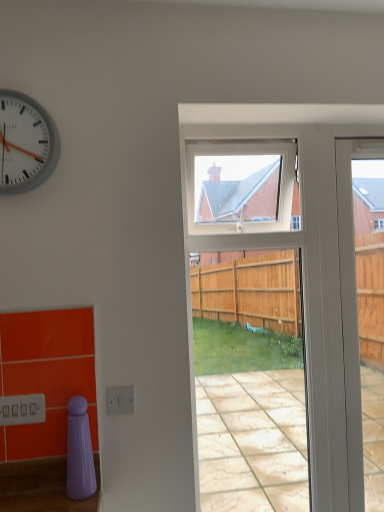
Question: Is white plastic clock at upper left surrounded by clear glass screen door at center?

Choices:
 (A) no
 (B) yes

Answer: (A)

Question: Is clear glass screen door at center thinner than white plastic clock at upper left?

Choices:
 (A) no
 (B) yes

Answer: (A)

Question: From a real-world perspective, is clear glass screen door at center under white plastic clock at upper left?

Choices:
 (A) yes
 (B) no

Answer: (A)

Question: Is clear glass screen door at center further to the viewer compared to white plastic clock at upper left?

Choices:
 (A) yes
 (B) no

Answer: (A)

Question: From the image's perspective, is clear glass screen door at center below white plastic clock at upper left?

Choices:
 (A) yes
 (B) no

Answer: (A)

Question: Does point (344, 346) appear closer or farther from the camera than point (355, 154)?

Choices:
 (A) farther
 (B) closer

Answer: (B)

Question: From the image's perspective, relative to white glossy door at right, is clear glass screen door at center above or below?

Choices:
 (A) below
 (B) above

Answer: (A)

Question: In terms of width, does clear glass screen door at center look wider or thinner when compared to white glossy door at right?

Choices:
 (A) wide
 (B) thin

Answer: (A)

Question: Based on their positions, is clear glass screen door at center located to the left or right of white glossy door at right?

Choices:
 (A) right
 (B) left

Answer: (B)

Question: From a real-world perspective, is white glossy door at right physically located above or below white plastic clock at upper left?

Choices:
 (A) above
 (B) below

Answer: (B)

Question: Considering the relative positions of white glossy door at right and white plastic clock at upper left in the image provided, is white glossy door at right to the left or to the right of white plastic clock at upper left?

Choices:
 (A) left
 (B) right

Answer: (B)

Question: Relative to white plastic clock at upper left, is white glossy door at right in front or behind?

Choices:
 (A) front
 (B) behind

Answer: (B)

Question: Does point (354, 493) appear closer or farther from the camera than point (41, 138)?

Choices:
 (A) closer
 (B) farther

Answer: (B)

Question: From a real-world perspective, is white plastic clock at upper left physically located above or below white glossy door at right?

Choices:
 (A) below
 (B) above

Answer: (B)

Question: In terms of size, does white plastic clock at upper left appear bigger or smaller than white glossy door at right?

Choices:
 (A) big
 (B) small

Answer: (B)